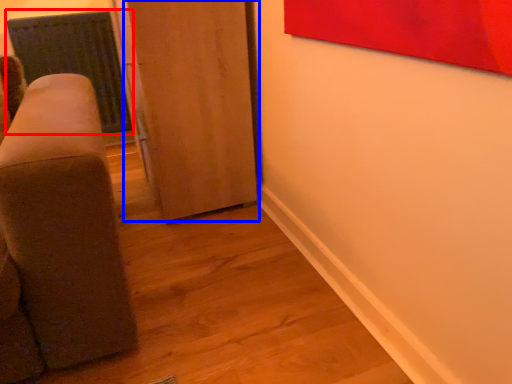
Question: Which object appears closest to the camera in this image, radiator (highlighted by a red box) or door (highlighted by a blue box)?

Choices:
 (A) radiator
 (B) door

Answer: (B)